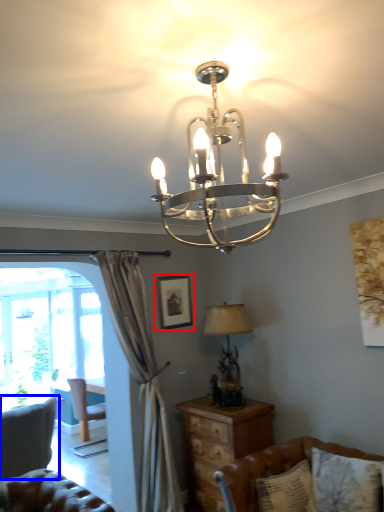
Question: Which object appears closest to the camera in this image, picture frame (highlighted by a red box) or swivel chair (highlighted by a blue box)?

Choices:
 (A) picture frame
 (B) swivel chair

Answer: (B)